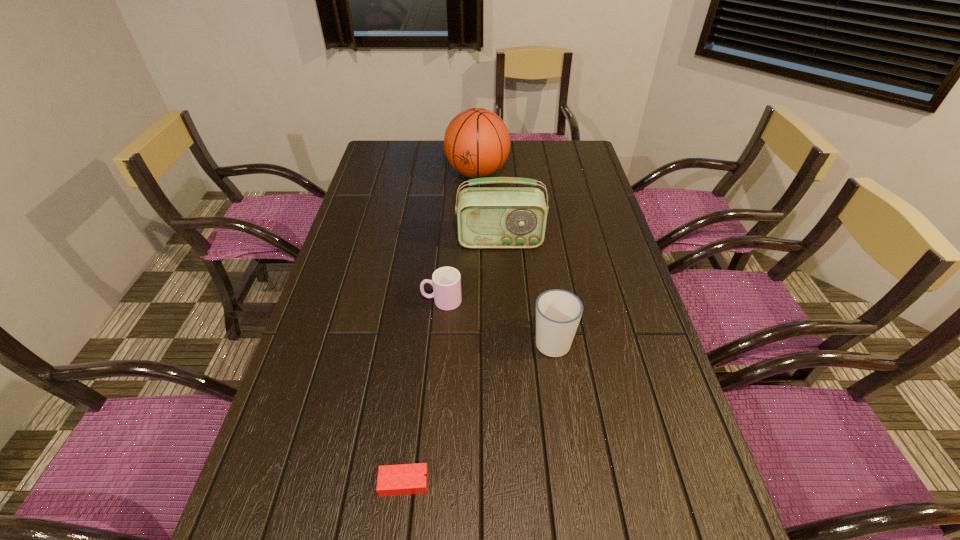
Find the location of a particular element. vacant space at the right edge of the desktop is located at coordinates (682, 522).

Locate an element on the screen. empty space that is in between the shortest object and the second farthest object is located at coordinates (452, 362).

Identify the location of vacant point located between the second shortest object and the third tallest object. (497, 321).

Find the location of a particular element. Image resolution: width=960 pixels, height=540 pixels. vacant point located between the third shortest object and the Lego is located at coordinates (478, 411).

Find the location of `empty space between the radio receiver and the Lego`. empty space between the radio receiver and the Lego is located at coordinates (452, 362).

Find the location of a particular element. The height and width of the screenshot is (540, 960). empty space between the fourth nearest object and the left cup is located at coordinates (471, 271).

Choose which object is the second nearest neighbor to the second farthest object. Please provide its 2D coordinates. Your answer should be formatted as a tuple, i.e. [(x, y)], where the tuple contains the x and y coordinates of a point satisfying the conditions above.

[(477, 143)]

Choose which object is the nearest neighbor to the fourth tallest object. Please provide its 2D coordinates. Your answer should be formatted as a tuple, i.e. [(x, y)], where the tuple contains the x and y coordinates of a point satisfying the conditions above.

[(487, 217)]

You are a GUI agent. You are given a task and a screenshot of the screen. Output one action in this format:
    pyautogui.click(x=<x>, y=<y>)
    Task: Click on the blank space that satisfies the following two spatial constraints: 1. with the handle on the side of the third nearest object; 2. on the back side of the basketball
    The height and width of the screenshot is (540, 960).
    Given the screenshot: What is the action you would take?
    pyautogui.click(x=452, y=174)

At what (x,y) coordinates should I click in order to perform the action: click on free point that satisfies the following two spatial constraints: 1. on the back side of the nearest object; 2. on the right side of the basketball. Please return your answer as a coordinate pair (x, y). Looking at the image, I should click on (441, 174).